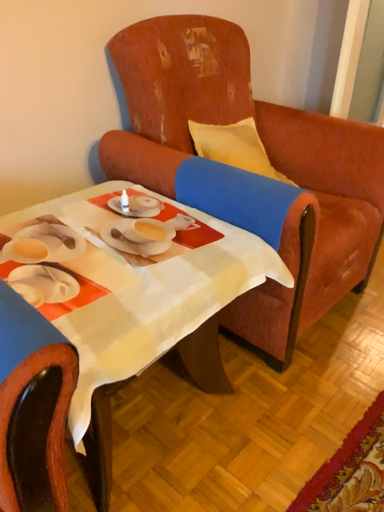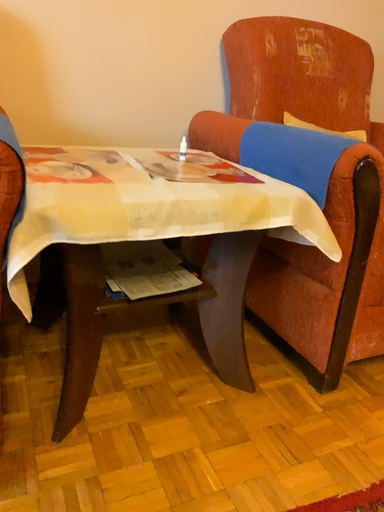
Question: Which way did the camera rotate in the video?

Choices:
 (A) rotated upward
 (B) rotated downward

Answer: (A)